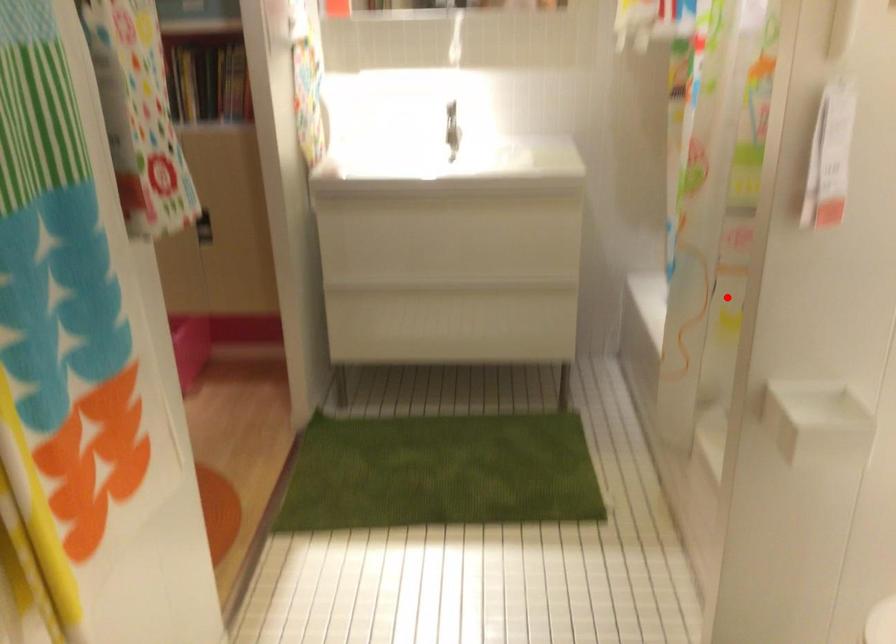
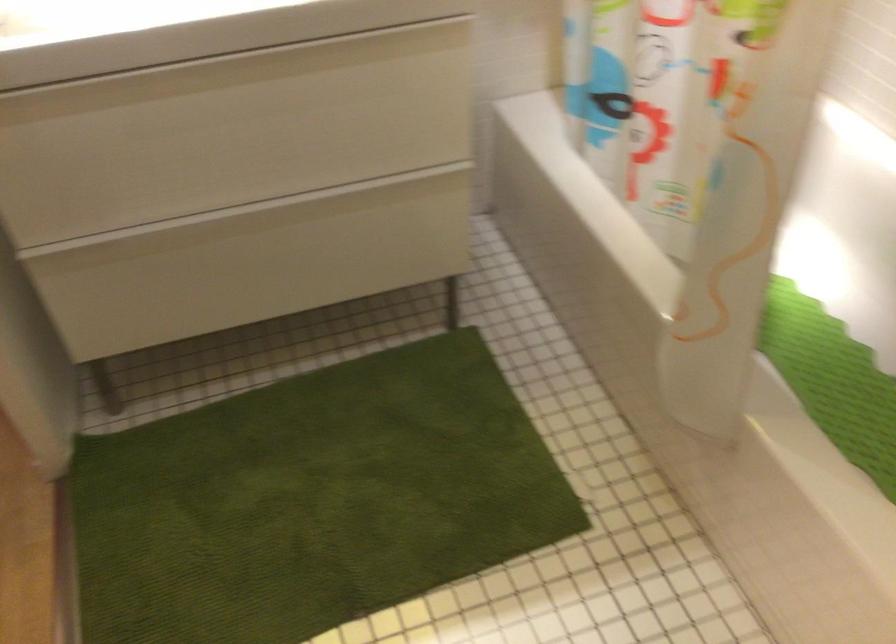
Where in the second image is the point corresponding to the highlighted location from the first image?

(700, 161)